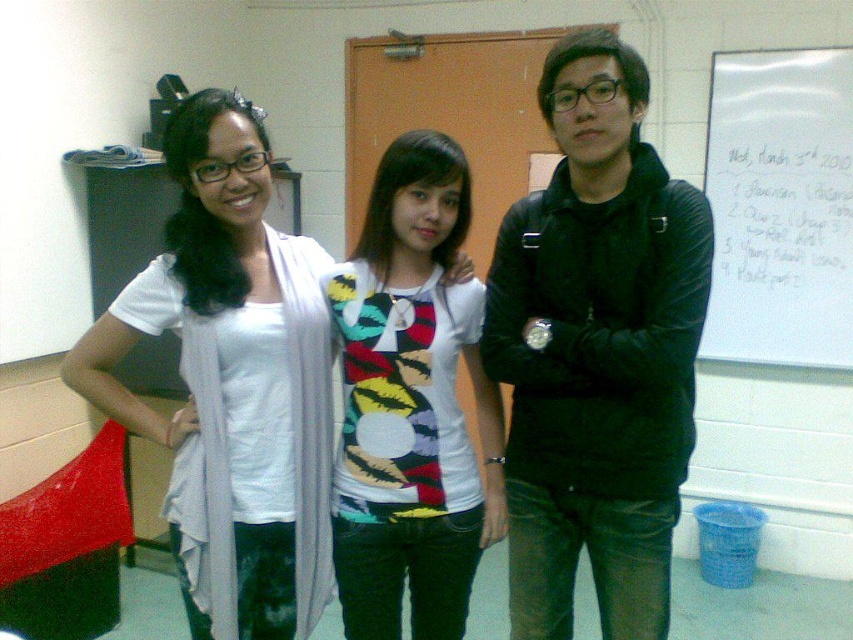
You are standing in a classroom and see the black matte jacket at center and the white matte scarf at left. Which object is located to the right of the other?

The black matte jacket at center is positioned on the right side of white matte scarf at left.

You are a photographer setting up for a group photo. You have a white matte scarf at left and a white paper at upper right in your frame. Which object is wider from your perspective?

The white matte scarf at left might be wider than white paper at upper right according to the description.

You are standing in a classroom and see two points marked on the wall. The first point is at coordinates point (267, 600) and the second is at point (811, 58). Which point is closer to you?

Point (267, 600) is closer to the viewer than point (811, 58).